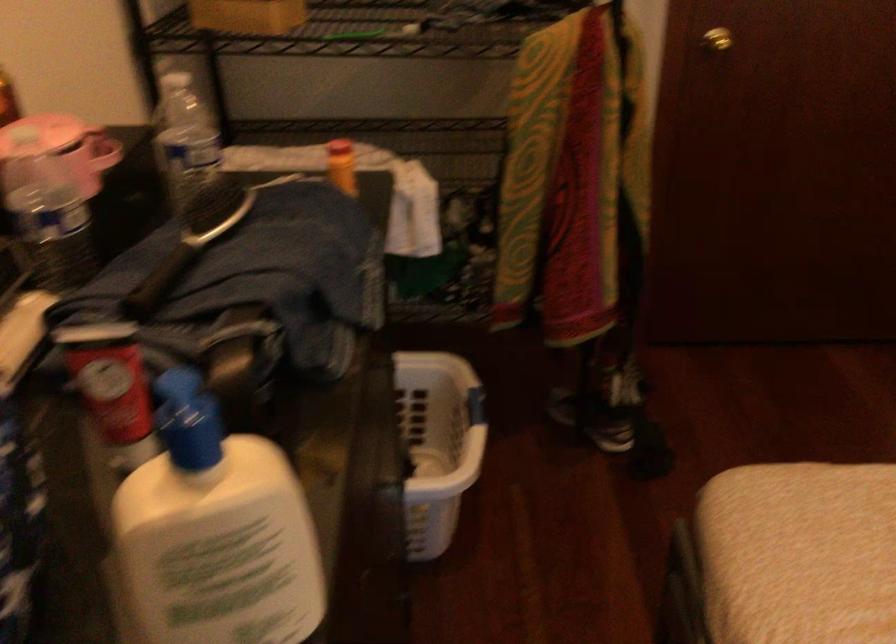
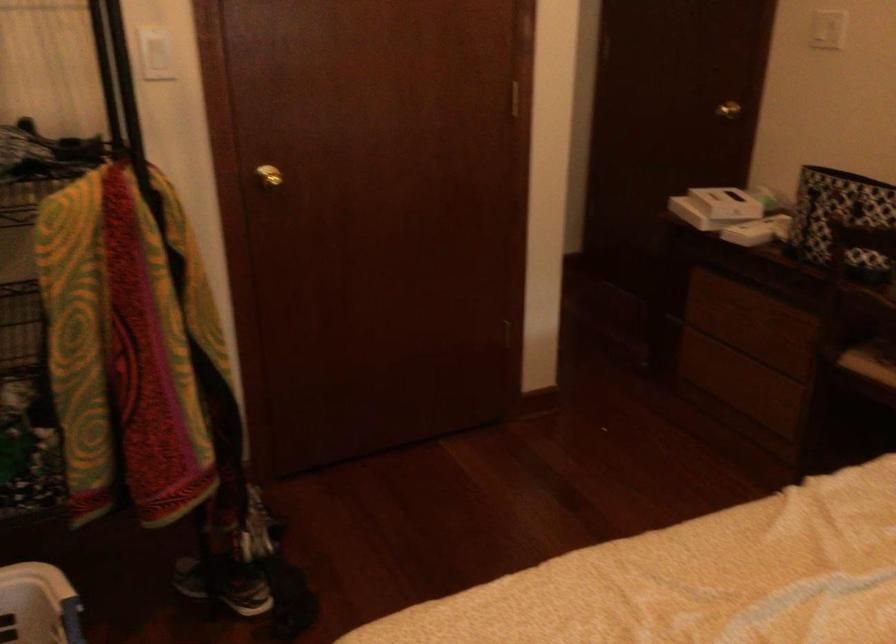
Find the pixel in the second image that matches (449,391) in the first image.

(38, 605)